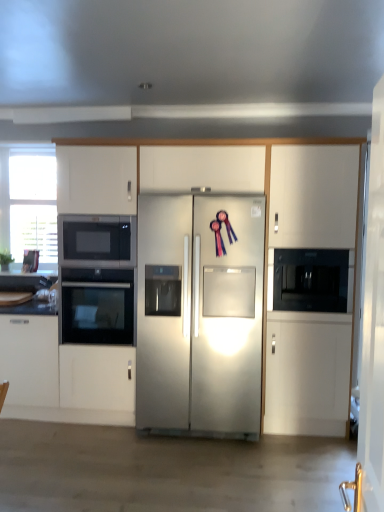
Describe the element at coordinates (204, 316) in the screenshot. I see `stainless steel refrigerator at center` at that location.

The height and width of the screenshot is (512, 384). What do you see at coordinates (274, 185) in the screenshot?
I see `satin white cabinets at center` at bounding box center [274, 185].

At what (x,y) coordinates should I click in order to perform the action: click on black glass oven at left, marked as the first oven in a bottom-to-top arrangement. Please return your answer as a coordinate pair (x, y). This screenshot has width=384, height=512. Looking at the image, I should click on (97, 306).

Describe the element at coordinates (373, 324) in the screenshot. I see `white glossy door at right` at that location.

Describe the element at coordinates (312, 280) in the screenshot. The height and width of the screenshot is (512, 384). I see `black matte microwave oven at right` at that location.

The height and width of the screenshot is (512, 384). Describe the element at coordinates (99, 239) in the screenshot. I see `black glass oven at left, the 1th oven from the top` at that location.

What do you see at coordinates (36, 304) in the screenshot?
I see `white glossy countertop at lower left` at bounding box center [36, 304].

I want to click on stainless steel refrigerator at center, so click(204, 316).

Is black matte microwave oven at right further to the viewer compared to white glossy countertop at lower left?

No, black matte microwave oven at right is closer to the viewer.

Between black matte microwave oven at right and white glossy countertop at lower left, which one has smaller size?

white glossy countertop at lower left.

Is black matte microwave oven at right taller than white glossy countertop at lower left?

Correct, black matte microwave oven at right is much taller as white glossy countertop at lower left.

Is black matte microwave oven at right not near white glossy countertop at lower left?

Yes.

Looking at this image, is black glass oven at left, acting as the second oven starting from the top, facing towards stainless steel refrigerator at center?

No, black glass oven at left, acting as the second oven starting from the top, is not turned towards stainless steel refrigerator at center.

Does black glass oven at left, marked as the first oven in a bottom-to-top arrangement, have a smaller size compared to stainless steel refrigerator at center?

Correct, black glass oven at left, marked as the first oven in a bottom-to-top arrangement, occupies less space than stainless steel refrigerator at center.

Is black glass oven at left, marked as the first oven in a bottom-to-top arrangement, to the right of stainless steel refrigerator at center from the viewer's perspective?

No, black glass oven at left, marked as the first oven in a bottom-to-top arrangement, is not to the right of stainless steel refrigerator at center.

In the scene shown: Does black glass oven at left, acting as the second oven starting from the top, contain stainless steel refrigerator at center?

No, stainless steel refrigerator at center is located outside of black glass oven at left, acting as the second oven starting from the top.

Is black matte microwave oven at right closer to camera compared to transparent glass window at left?

Yes, black matte microwave oven at right is closer to the camera.

Does black matte microwave oven at right appear on the left side of transparent glass window at left?

In fact, black matte microwave oven at right is to the right of transparent glass window at left.

From a real-world perspective, is black matte microwave oven at right beneath transparent glass window at left?

Indeed, from a real-world perspective, black matte microwave oven at right is positioned beneath transparent glass window at left.

Is black matte microwave oven at right inside the boundaries of transparent glass window at left, or outside?

black matte microwave oven at right exists outside the volume of transparent glass window at left.

Can you confirm if white glossy countertop at lower left is shorter than black matte microwave oven at right?

Yes, white glossy countertop at lower left is shorter than black matte microwave oven at right.

From the image's perspective, between white glossy countertop at lower left and black matte microwave oven at right, who is located below?

white glossy countertop at lower left, from the image's perspective.

Are white glossy countertop at lower left and black matte microwave oven at right far apart?

Yes, white glossy countertop at lower left and black matte microwave oven at right are located far from each other.

Are black glass oven at left, acting as the second oven starting from the top, and black matte microwave oven at right located far from each other?

Indeed, black glass oven at left, acting as the second oven starting from the top, is not near black matte microwave oven at right.

From a real-world perspective, is black glass oven at left, marked as the first oven in a bottom-to-top arrangement, positioned above or below black matte microwave oven at right?

Clearly, from a real-world perspective, black glass oven at left, marked as the first oven in a bottom-to-top arrangement, is below black matte microwave oven at right.

Is black glass oven at left, acting as the second oven starting from the top, closer to camera compared to black matte microwave oven at right?

No, black glass oven at left, acting as the second oven starting from the top, is behind black matte microwave oven at right.

Between black glass oven at left, acting as the second oven starting from the top, and black matte microwave oven at right, which one appears on the right side from the viewer's perspective?

From the viewer's perspective, black matte microwave oven at right appears more on the right side.

Is satin white cabinets at center bigger than black glass oven at left, which is counted as the 2th oven, starting from the bottom?

Correct, satin white cabinets at center is larger in size than black glass oven at left, which is counted as the 2th oven, starting from the bottom.

How much distance is there between satin white cabinets at center and black glass oven at left, the 1th oven from the top?

satin white cabinets at center is 26.81 inches away from black glass oven at left, the 1th oven from the top.

Can you tell me how much satin white cabinets at center and black glass oven at left, which is counted as the 2th oven, starting from the bottom, differ in facing direction?

They differ by 0.131 degrees in their facing directions.

Is satin white cabinets at center thinner than black glass oven at left, the 1th oven from the top?

No.

Considering the relative sizes of black glass oven at left, acting as the second oven starting from the top, and white glossy countertop at lower left in the image provided, is black glass oven at left, acting as the second oven starting from the top, shorter than white glossy countertop at lower left?

In fact, black glass oven at left, acting as the second oven starting from the top, may be taller than white glossy countertop at lower left.

Considering the relative positions of black glass oven at left, marked as the first oven in a bottom-to-top arrangement, and white glossy countertop at lower left in the image provided, is black glass oven at left, marked as the first oven in a bottom-to-top arrangement, to the left or to the right of white glossy countertop at lower left?

Clearly, black glass oven at left, marked as the first oven in a bottom-to-top arrangement, is on the right of white glossy countertop at lower left in the image.

Could you tell me if black glass oven at left, acting as the second oven starting from the top, is facing white glossy countertop at lower left?

No, black glass oven at left, acting as the second oven starting from the top, is not facing towards white glossy countertop at lower left.

Where is `microwave oven lying in front of the white glossy countertop at lower left`? microwave oven lying in front of the white glossy countertop at lower left is located at coordinates (312, 280).

What are the coordinates of `the 1st oven above when counting from the stainless steel refrigerator at center (from the image's perspective)` in the screenshot? It's located at (97, 306).

Considering their positions, is stainless steel refrigerator at center positioned closer to transparent glass window at left than white glossy countertop at lower left?

white glossy countertop at lower left.

Based on their spatial positions, is black glass oven at left, the 1th oven from the top, or black matte microwave oven at right further from transparent glass window at left?

The object further to transparent glass window at left is black matte microwave oven at right.

Based on their spatial positions, is white glossy door at right or stainless steel refrigerator at center closer to black glass oven at left, acting as the second oven starting from the top?

stainless steel refrigerator at center lies closer to black glass oven at left, acting as the second oven starting from the top, than the other object.

Considering their positions, is black glass oven at left, marked as the first oven in a bottom-to-top arrangement, positioned further to stainless steel refrigerator at center than white glossy door at right?

The object further to stainless steel refrigerator at center is white glossy door at right.

Looking at the image, which one is located closer to black glass oven at left, acting as the second oven starting from the top, stainless steel refrigerator at center or transparent glass window at left?

Based on the image, stainless steel refrigerator at center appears to be nearer to black glass oven at left, acting as the second oven starting from the top.

Looking at the image, which one is located further to satin white cabinets at center, black matte microwave oven at right or transparent glass window at left?

transparent glass window at left is further to satin white cabinets at center.

From the image, which object appears to be farther from black glass oven at left, which is counted as the 2th oven, starting from the bottom, white glossy countertop at lower left or white glossy door at right?

white glossy door at right lies further to black glass oven at left, which is counted as the 2th oven, starting from the bottom, than the other object.

Which object lies nearer to the anchor point black matte microwave oven at right, transparent glass window at left or black glass oven at left, marked as the first oven in a bottom-to-top arrangement?

Among the two, black glass oven at left, marked as the first oven in a bottom-to-top arrangement, is located nearer to black matte microwave oven at right.

At what (x,y) coordinates should I click in order to perform the action: click on cabinetry between white glossy door at right and black matte microwave oven at right along the z-axis. Please return your answer as a coordinate pair (x, y). This screenshot has width=384, height=512. Looking at the image, I should click on (274, 185).

Identify the location of refrigerator between white glossy door at right and black glass oven at left, the 1th oven from the top, along the z-axis. This screenshot has width=384, height=512. click(x=204, y=316).

Where is `microwave oven between white glossy door at right and white glossy countertop at lower left in the front-back direction`? The width and height of the screenshot is (384, 512). microwave oven between white glossy door at right and white glossy countertop at lower left in the front-back direction is located at coordinates (312, 280).

Image resolution: width=384 pixels, height=512 pixels. Find the location of `countertop between transparent glass window at left and stainless steel refrigerator at center from left to right`. countertop between transparent glass window at left and stainless steel refrigerator at center from left to right is located at coordinates (36, 304).